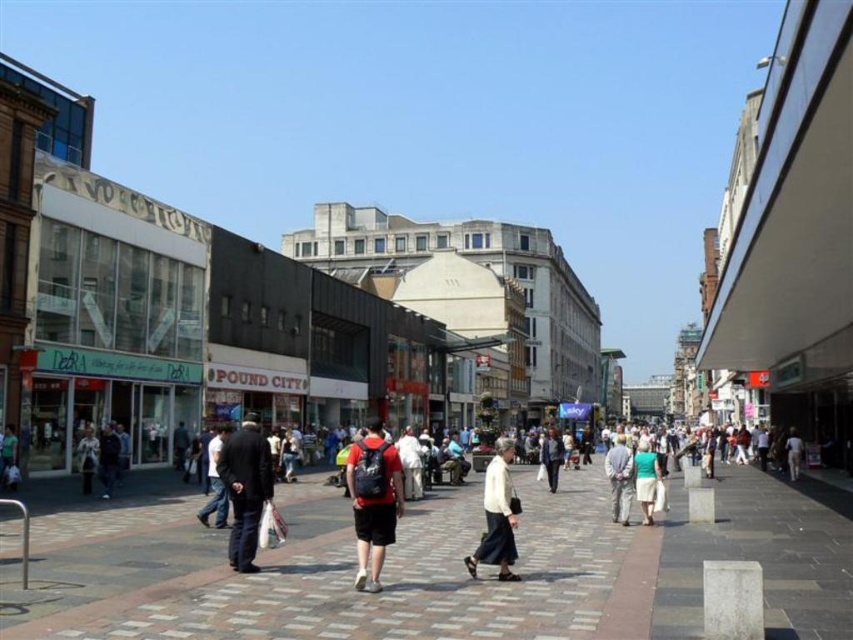
Based on the photo, you are a customer in a clothing store and see both the light gray fabric pants at center and the light green fabric dress at center displayed on a mannequin. Which item is placed lower on the mannequin?

The light gray fabric pants at center is positioned under the light green fabric dress at center, so it is placed lower on the mannequin.

You are standing on the street and see both the paved stone pavement at center and the light green fabric dress at center. Which object is nearer to you?

The paved stone pavement at center is closer to the viewer than the light green fabric dress at center.